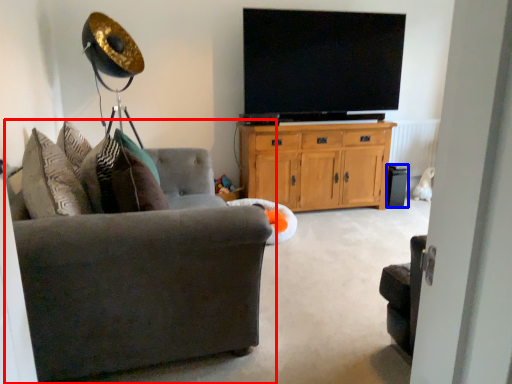
Question: Among these objects, which one is nearest to the camera, studio couch (highlighted by a red box) or speaker (highlighted by a blue box)?

Choices:
 (A) studio couch
 (B) speaker

Answer: (A)